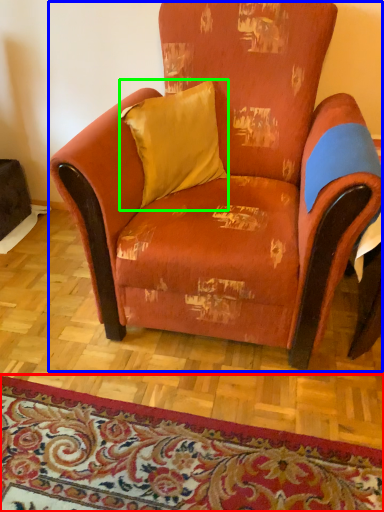
Question: Which is nearer to the mat (highlighted by a red box)? chair (highlighted by a blue box) or pillow (highlighted by a green box).

Choices:
 (A) chair
 (B) pillow

Answer: (A)